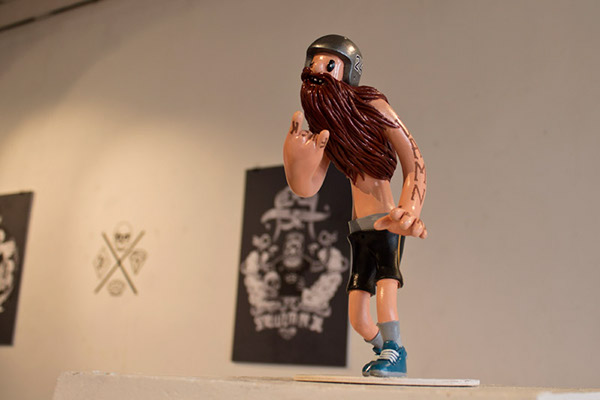
Image resolution: width=600 pixels, height=400 pixels. Identify the location of figurine. (374, 196).